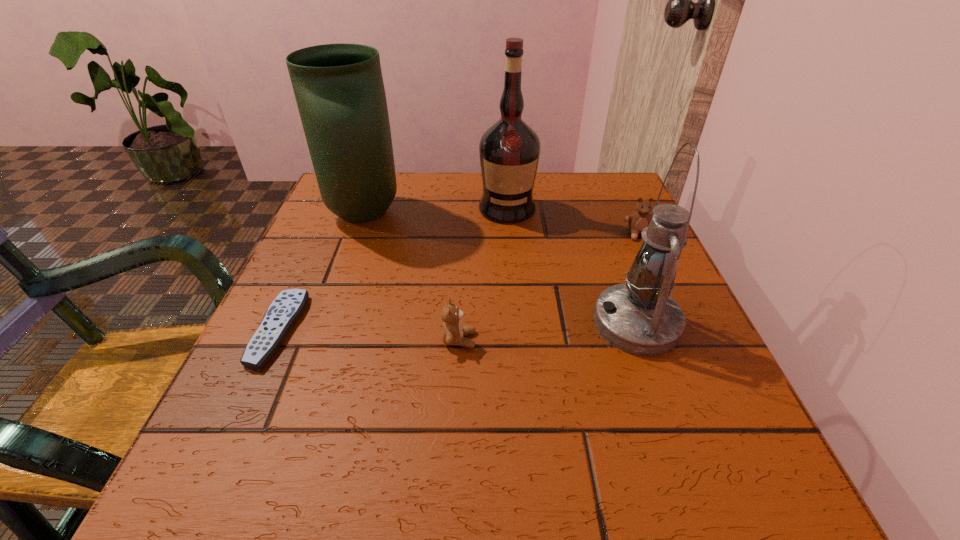
Locate an element on the screen. The width and height of the screenshot is (960, 540). vacant space at the far edge of the desktop is located at coordinates (416, 191).

You are a GUI agent. You are given a task and a screenshot of the screen. Output one action in this format:
    pyautogui.click(x=<x>, y=<y>)
    Task: Click on the free spot at the near edge of the desktop
    
    Given the screenshot: What is the action you would take?
    click(x=368, y=504)

Where is `free space at the left edge of the desktop`? The height and width of the screenshot is (540, 960). free space at the left edge of the desktop is located at coordinates click(295, 371).

Find the location of a particular element. This screenshot has width=960, height=540. vacant space at the right edge of the desktop is located at coordinates (621, 246).

At what (x,y) coordinates should I click in order to perform the action: click on free space at the far right corner of the desktop. Please return your answer as a coordinate pair (x, y). Looking at the image, I should click on (584, 218).

This screenshot has height=540, width=960. Find the location of `vacant space at the near right corner of the desktop`. vacant space at the near right corner of the desktop is located at coordinates (717, 488).

I want to click on vacant area between the vase and the left teddy bear, so click(412, 277).

Find the location of a particular element. free space that is in between the vase and the right teddy bear is located at coordinates point(501,224).

Image resolution: width=960 pixels, height=540 pixels. Identify the location of vacant area between the shortest object and the liquor. (393, 269).

You are a GUI agent. You are given a task and a screenshot of the screen. Output one action in this format:
    pyautogui.click(x=<x>, y=<y>)
    Task: Click on the empty location between the third object from left to right and the right teddy bear
    
    Given the screenshot: What is the action you would take?
    pyautogui.click(x=549, y=287)